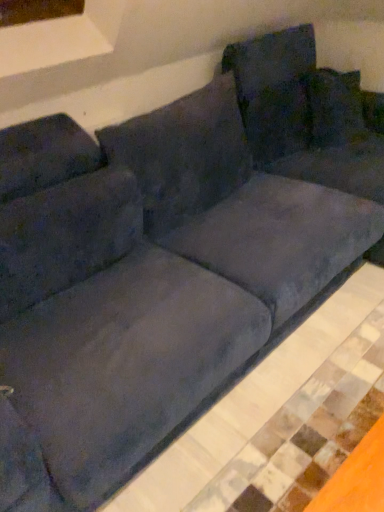
Measure the distance between velvety dark blue pillow at center and camera.

The depth of velvety dark blue pillow at center is 1.70 meters.

Locate an element on the screen. This screenshot has width=384, height=512. velvety dark blue pillow at center is located at coordinates (183, 154).

This screenshot has height=512, width=384. Describe the element at coordinates (183, 154) in the screenshot. I see `velvety dark blue pillow at center` at that location.

What are the coordinates of `velvety dark blue pillow at center` in the screenshot? It's located at (183, 154).